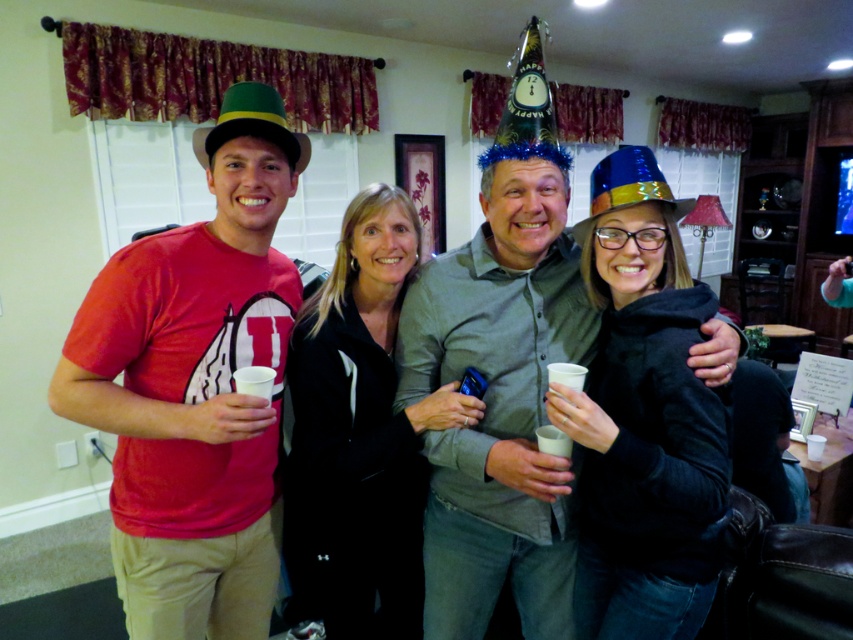
Can you confirm if green felt party hat at upper left is shorter than white paper cup at center?

No.

Can you confirm if green felt party hat at upper left is positioned below white paper cup at center?

Incorrect, green felt party hat at upper left is not positioned below white paper cup at center.

Does point (309, 148) come in front of point (567, 368)?

No, it is behind (567, 368).

The height and width of the screenshot is (640, 853). Identify the location of green felt party hat at upper left. (251, 124).

From the picture: Is matte red t-shirt at left wider than white paper cup at center?

Indeed, matte red t-shirt at left has a greater width compared to white paper cup at center.

Who is shorter, matte red t-shirt at left or white paper cup at center?

With less height is white paper cup at center.

In the scene shown: Measure the distance between point (x=233, y=552) and camera.

Point (x=233, y=552) is 4.74 feet away from camera.

You are a GUI agent. You are given a task and a screenshot of the screen. Output one action in this format:
    pyautogui.click(x=<x>, y=<y>)
    Task: Click on the matte red t-shirt at left
    
    Given the screenshot: What is the action you would take?
    pyautogui.click(x=195, y=387)

Does green felt party hat at upper left appear on the left side of shiny metallic party hat at center?

Yes, green felt party hat at upper left is to the left of shiny metallic party hat at center.

In the scene shown: Can you confirm if green felt party hat at upper left is positioned below shiny metallic party hat at center?

No.

Does point (225, 108) lie behind point (572, 230)?

That is False.

Where is `green felt party hat at upper left`? This screenshot has width=853, height=640. green felt party hat at upper left is located at coordinates (251, 124).